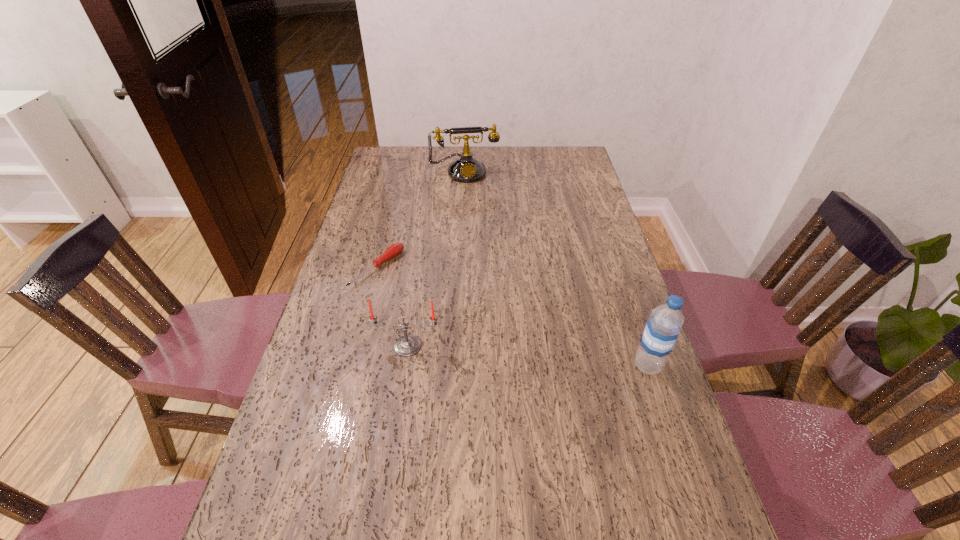
This screenshot has height=540, width=960. In order to click on candle in this screenshot , I will do `click(408, 345)`.

Locate an element on the screen. The height and width of the screenshot is (540, 960). the rightmost object is located at coordinates (663, 326).

What are the coordinates of `the third nearest object` in the screenshot? It's located at (394, 250).

Where is `screwdriver`? The image size is (960, 540). screwdriver is located at coordinates point(394,250).

At what (x,y) coordinates should I click in order to perform the action: click on telephone. Please return your answer as a coordinate pair (x, y). Looking at the image, I should click on (466, 169).

Where is `vacant space located 0.150m on the front-facing side of the candle`? The width and height of the screenshot is (960, 540). vacant space located 0.150m on the front-facing side of the candle is located at coordinates (398, 409).

Identify the location of vacant space located on the label of the water bottle. Image resolution: width=960 pixels, height=540 pixels. (570, 366).

At what (x,y) coordinates should I click in order to perform the action: click on free location located 0.170m on the label of the water bottle. Please return your answer as a coordinate pair (x, y). Looking at the image, I should click on (565, 366).

Locate an element on the screen. free region located 0.360m on the label of the water bottle is located at coordinates (492, 366).

This screenshot has height=540, width=960. In order to click on free space located at the tip of the third nearest object in this screenshot , I will do `click(428, 300)`.